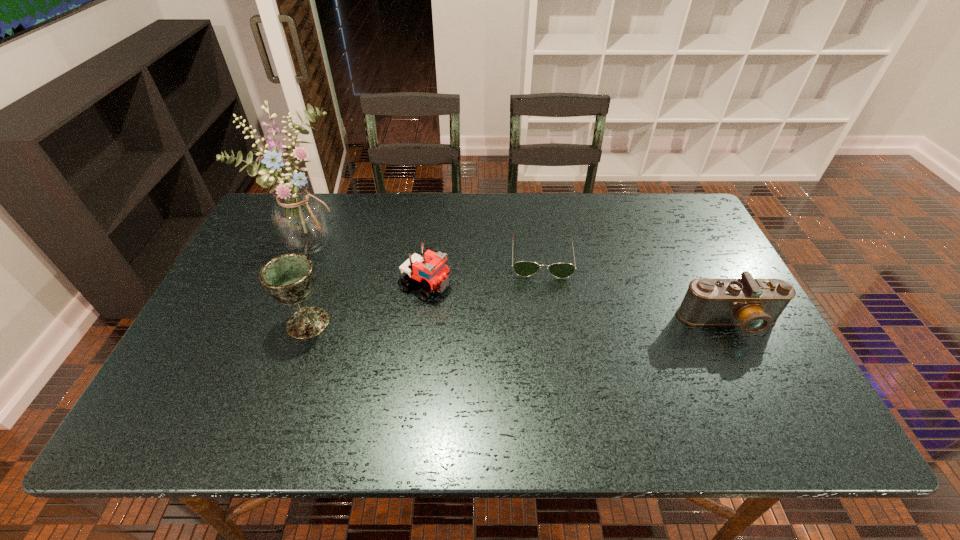
Locate an element on the screen. vacant space positioned 0.260m on the front-facing side of the sunglasses is located at coordinates (546, 357).

Where is `free region located on the front-facing side of the Lego`? Image resolution: width=960 pixels, height=540 pixels. free region located on the front-facing side of the Lego is located at coordinates (471, 306).

Locate an element on the screen. The height and width of the screenshot is (540, 960). blank area located on the front-facing side of the Lego is located at coordinates (586, 361).

The height and width of the screenshot is (540, 960). I want to click on free space located 0.280m on the front-facing side of the Lego, so click(x=540, y=339).

Identify the location of vacant space located on the front-facing side of the tallest object. click(373, 274).

The height and width of the screenshot is (540, 960). What are the coordinates of `vacant area situated on the front-facing side of the tallest object` in the screenshot? It's located at (420, 299).

I want to click on vacant space situated 0.320m on the front-facing side of the tallest object, so click(420, 299).

The width and height of the screenshot is (960, 540). Identify the location of sunglasses that is at the far edge. (522, 268).

Locate an element on the screen. bouquet located in the far edge section of the desktop is located at coordinates (300, 219).

At what (x,y) coordinates should I click in order to perform the action: click on object present at the left edge. Please return your answer as a coordinate pair (x, y). Looking at the image, I should click on (300, 219).